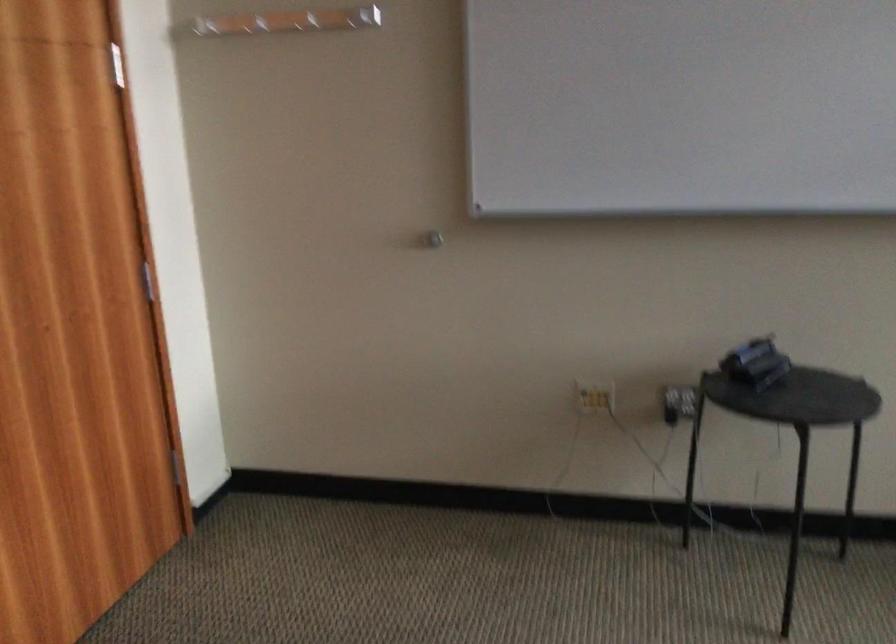
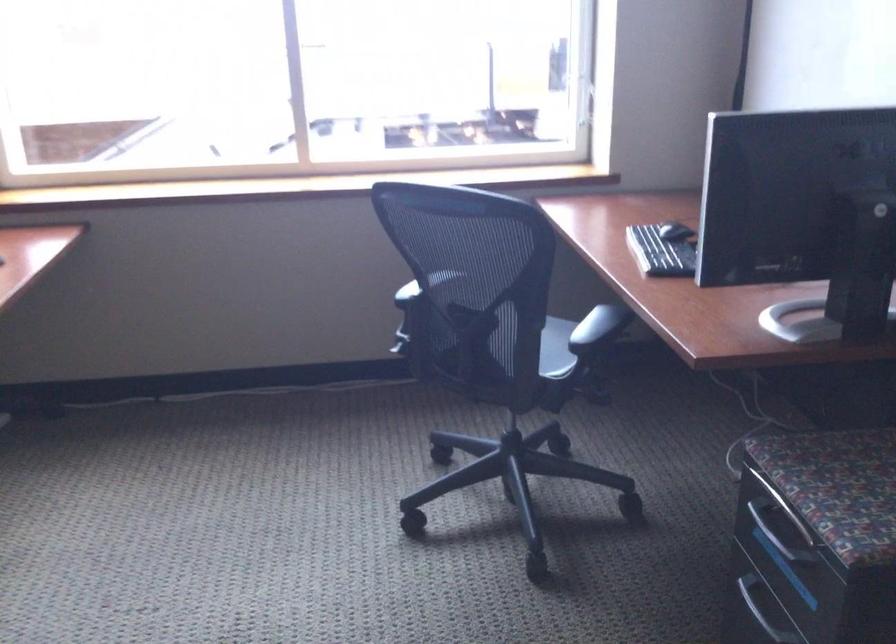
First-person continuous shooting, in which direction is the camera rotating?

The rotation direction of the camera is right-down.